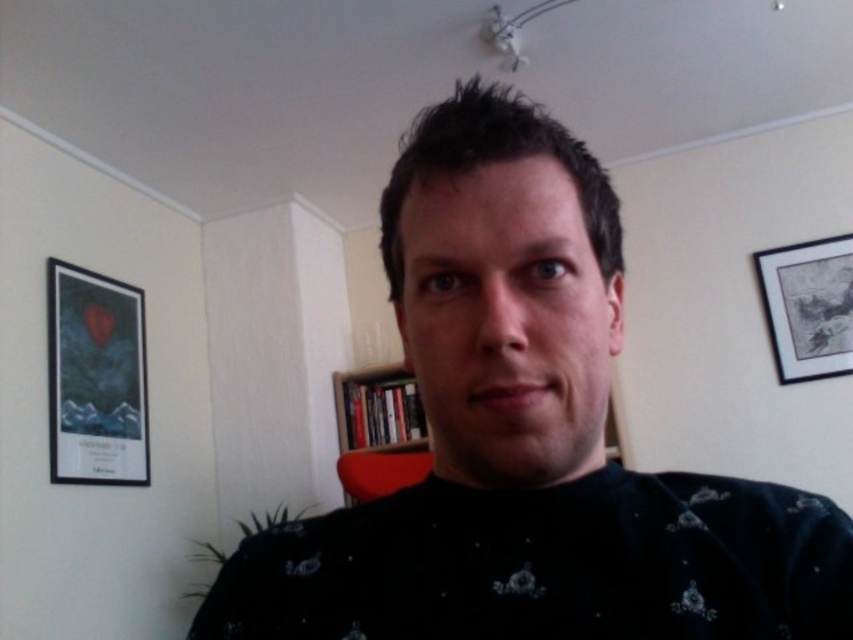
Question: Which point is closer to the camera?

Choices:
 (A) dark blue sweater at center
 (B) matte black picture frame at left

Answer: (A)

Question: Considering the real-world distances, which object is closest to the matte black picture frame at upper right?

Choices:
 (A) wooden bookshelf at center
 (B) matte black picture frame at left
 (C) dark blue sweater at center

Answer: (A)

Question: Does matte black picture frame at upper right appear over wooden bookshelf at center?

Choices:
 (A) yes
 (B) no

Answer: (A)

Question: Observing the image, what is the correct spatial positioning of matte black picture frame at upper right in reference to wooden bookshelf at center?

Choices:
 (A) right
 (B) left

Answer: (A)

Question: Is dark blue sweater at center to the right of matte black picture frame at left from the viewer's perspective?

Choices:
 (A) yes
 (B) no

Answer: (A)

Question: Which of the following is the closest to the observer?

Choices:
 (A) (390, 422)
 (B) (108, 408)

Answer: (B)